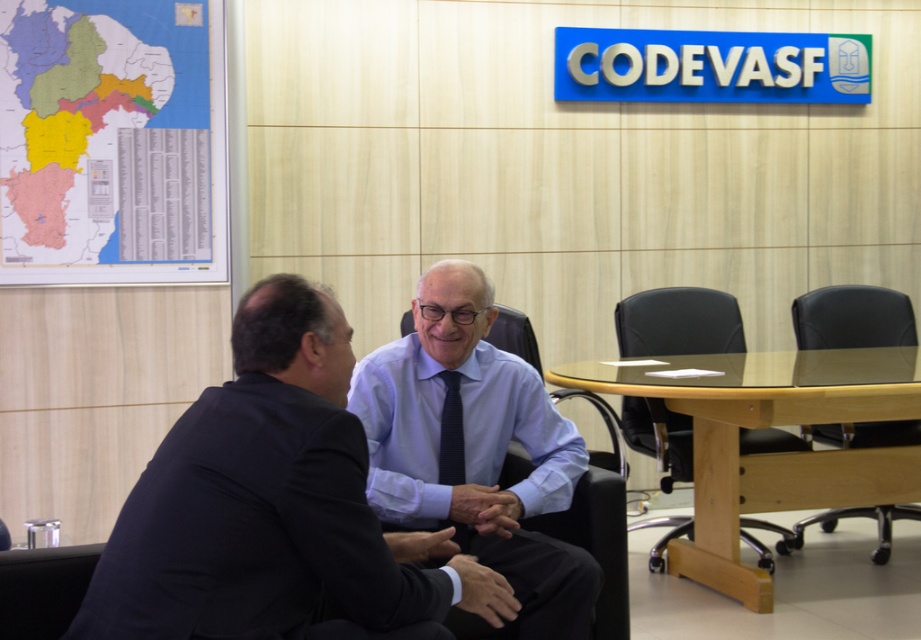
Can you confirm if light brown wooden table at center is smaller than black leather chair at right?

Incorrect, light brown wooden table at center is not smaller in size than black leather chair at right.

Looking at this image, is light brown wooden table at center to the left of black leather chair at right from the viewer's perspective?

Correct, you'll find light brown wooden table at center to the left of black leather chair at right.

Who is more forward, (704,552) or (846,326)?

Point (704,552)

You are a GUI agent. You are given a task and a screenshot of the screen. Output one action in this format:
    pyautogui.click(x=<x>, y=<y>)
    Task: Click on the light brown wooden table at center
    Image resolution: width=921 pixels, height=640 pixels.
    Given the screenshot: What is the action you would take?
    pyautogui.click(x=771, y=452)

Does matte black suit at center have a lesser width compared to black leather chair at right?

Incorrect, matte black suit at center's width is not less than black leather chair at right's.

Based on the photo, who is positioned more to the right, matte black suit at center or black leather chair at right?

Positioned to the right is black leather chair at right.

Find the location of `matte black suit at center`. matte black suit at center is located at coordinates (274, 508).

This screenshot has height=640, width=921. Find the location of `matte black suit at center`. matte black suit at center is located at coordinates (274, 508).

Is light blue shirt at center to the left of light brown wooden table at center from the viewer's perspective?

Correct, you'll find light blue shirt at center to the left of light brown wooden table at center.

Does light blue shirt at center have a lesser width compared to light brown wooden table at center?

Yes.

Does point (526, 561) come in front of point (613, 378)?

Yes, it is in front of point (613, 378).

Identify the location of light blue shirt at center. (474, 452).